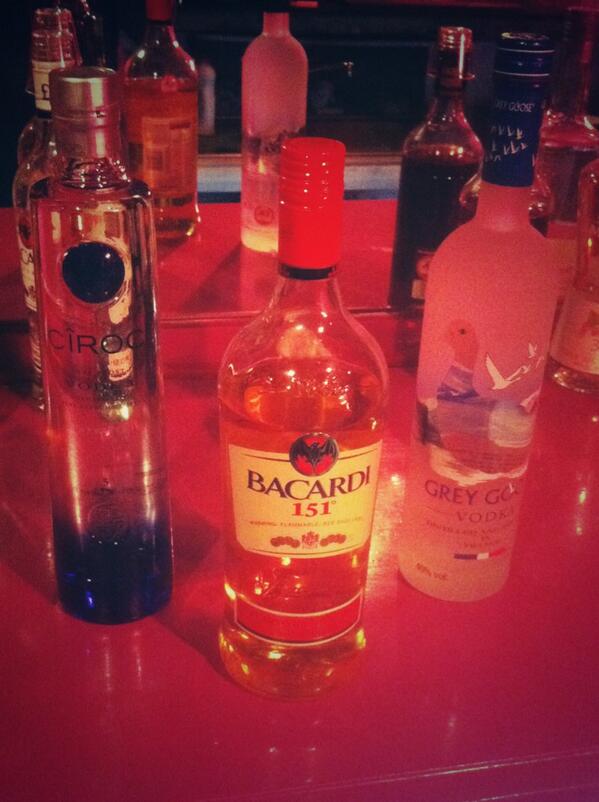
In order to click on whiskey bottle in this screenshot , I will do `click(431, 184)`.